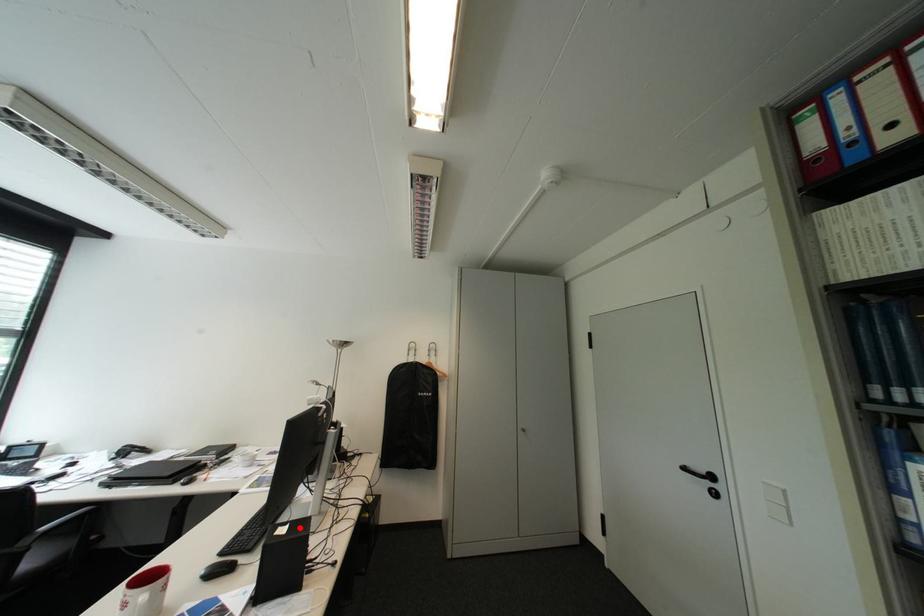
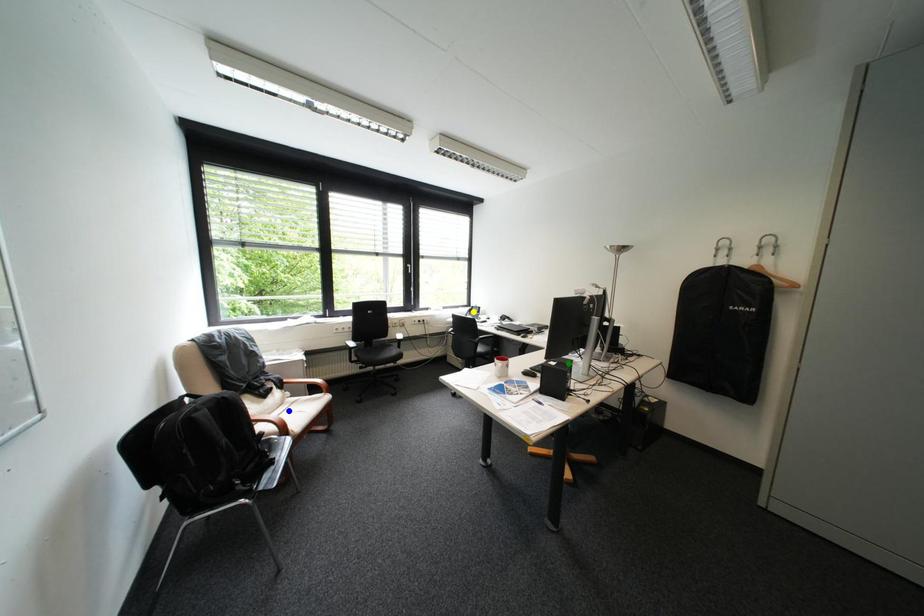
Question: I am providing you with two images of the same scene from different viewpoints. A red point is marked on the first image. You are given multiple points on the second image. Which mark in image 2 goes with the point in image 1?

Choices:
 (A) green point
 (B) yellow point
 (C) blue point

Answer: (A)